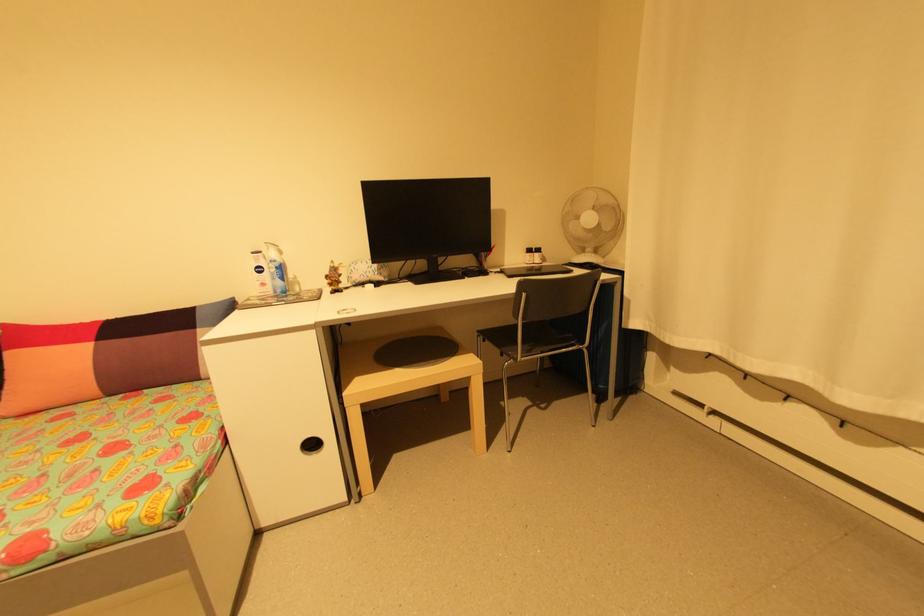
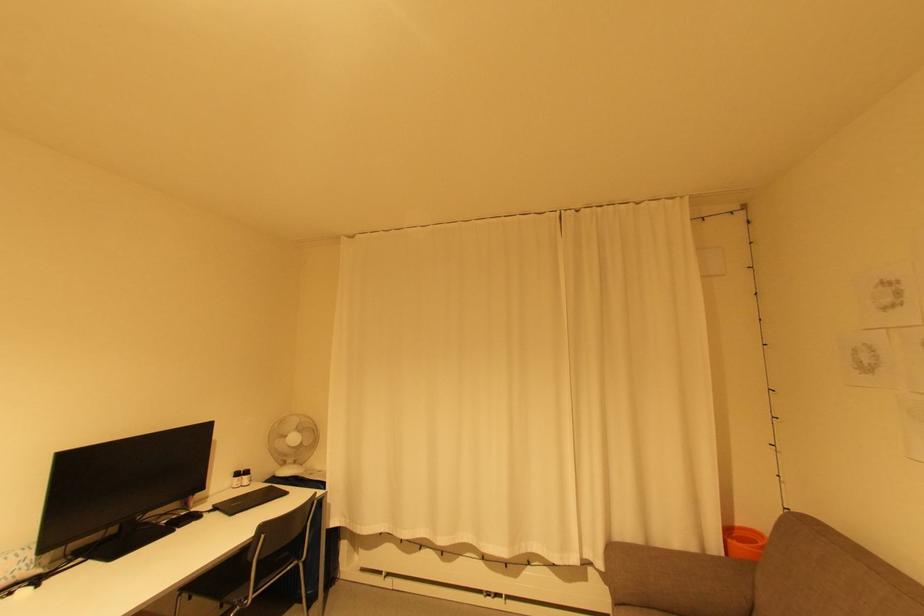
Locate, in the second image, the point that corresponds to the point at 593,219 in the first image.

(298, 439)